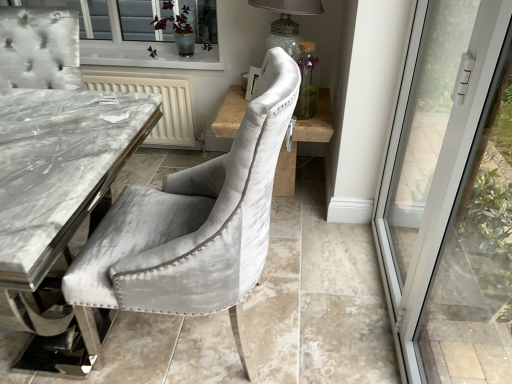
Measure the distance between velvet grey chair at center and camera.

They are 95.61 centimeters apart.

The image size is (512, 384). I want to click on velvet chair at center, so click(x=318, y=296).

Is velvet grey chair at center outside of velvet chair at center?

Yes.

Does velvet grey chair at center have a lesser width compared to velvet chair at center?

Indeed, velvet grey chair at center has a lesser width compared to velvet chair at center.

Between velvet grey chair at center and velvet chair at center, which one has more height?

velvet grey chair at center.

Which point is more forward, (220, 262) or (100, 377)?

The point (220, 262) is in front.

Who is bigger, light brown wood side table at center or transparent glass door at right?

light brown wood side table at center is bigger.

You are a GUI agent. You are given a task and a screenshot of the screen. Output one action in this format:
    pyautogui.click(x=<x>, y=<y>)
    Task: Click on the side table located above the transparent glass door at right (from the image's perspective)
    The width and height of the screenshot is (512, 384).
    Given the screenshot: What is the action you would take?
    pyautogui.click(x=303, y=141)

From a real-world perspective, is light brown wood side table at center over transparent glass door at right?

Incorrect, from a real-world perspective, light brown wood side table at center is lower than transparent glass door at right.

Consider the image. How far apart are light brown wood side table at center and transparent glass door at right?

32.25 inches.

Is transparent glass door at right further to camera compared to light brown wood side table at center?

No, transparent glass door at right is closer to the viewer.

Is transparent glass door at right beside light brown wood side table at center?

No, transparent glass door at right is not touching light brown wood side table at center.

In the scene shown: Could you tell me if transparent glass door at right is turned towards light brown wood side table at center?

No, transparent glass door at right is not aimed at light brown wood side table at center.

From a real-world perspective, is transparent glass door at right physically located above or below light brown wood side table at center?

From a real-world perspective, transparent glass door at right is physically above light brown wood side table at center.

Relative to velvet chair at center, is transparent glass door at right in front or behind?

transparent glass door at right is positioned closer to the viewer than velvet chair at center.

Which is correct: transparent glass door at right is inside velvet chair at center, or outside of it?

transparent glass door at right is not enclosed by velvet chair at center.

Is transparent glass door at right turned away from velvet chair at center?

No, velvet chair at center is not at the back of transparent glass door at right.

From the image's perspective, which one is positioned lower, transparent glass door at right or velvet chair at center?

velvet chair at center appears lower in the image.

From the image's perspective, is purple velvet plant at upper center on top of light brown wood side table at center?

Yes, from the image's perspective, purple velvet plant at upper center is on top of light brown wood side table at center.

Between purple velvet plant at upper center and light brown wood side table at center, which one appears on the right side from the viewer's perspective?

Positioned to the right is light brown wood side table at center.

Image resolution: width=512 pixels, height=384 pixels. In order to click on plant above the light brown wood side table at center (from the image's perspective) in this screenshot , I will do `click(179, 30)`.

Is velvet grey chair at center at the back of velvet chair at center?

velvet chair at center does not have its back to velvet grey chair at center.

Which is closer, (132,324) or (271,67)?

The point (271,67) is in front.

In the scene shown: Considering the relative positions of velvet chair at center and velvet grey chair at center in the image provided, is velvet chair at center to the right of velvet grey chair at center from the viewer's perspective?

In fact, velvet chair at center is to the left of velvet grey chair at center.

Is velvet chair at center surrounding velvet grey chair at center?

Actually, velvet grey chair at center is outside velvet chair at center.

Is light brown wood side table at center positioned far away from velvet chair at center?

That's not correct — light brown wood side table at center is a little close to velvet chair at center.

Identify the location of side table lying on the right of velvet chair at center. The height and width of the screenshot is (384, 512). (303, 141).

Is light brown wood side table at center facing towards velvet chair at center?

No, light brown wood side table at center is not facing towards velvet chair at center.

In order to click on chair above the velvet chair at center (from a real-world perspective) in this screenshot , I will do [195, 223].

Where is `side table on the left of transparent glass door at right`? The height and width of the screenshot is (384, 512). side table on the left of transparent glass door at right is located at coordinates (303, 141).

From the image, which object appears to be nearer to transparent glass door at right, velvet chair at center or purple velvet plant at upper center?

velvet chair at center is closer to transparent glass door at right.

Estimate the real-world distances between objects in this image. Which object is closer to purple velvet plant at upper center, velvet chair at center or velvet grey chair at center?

Among the two, velvet chair at center is located nearer to purple velvet plant at upper center.

When comparing their distances from purple velvet plant at upper center, does velvet grey chair at center or velvet chair at center seem closer?

velvet chair at center is positioned closer to the anchor purple velvet plant at upper center.

From the image, which object appears to be nearer to purple velvet plant at upper center, transparent glass door at right or velvet chair at center?

velvet chair at center lies closer to purple velvet plant at upper center than the other object.

Looking at the image, which one is located further to velvet grey chair at center, transparent glass door at right or light brown wood side table at center?

Among the two, light brown wood side table at center is located further to velvet grey chair at center.

Considering their positions, is velvet chair at center positioned closer to purple velvet plant at upper center than light brown wood side table at center?

The object closer to purple velvet plant at upper center is light brown wood side table at center.

Which object lies nearer to the anchor point light brown wood side table at center, velvet chair at center or purple velvet plant at upper center?

velvet chair at center is positioned closer to the anchor light brown wood side table at center.

Based on their spatial positions, is velvet chair at center or light brown wood side table at center further from transparent glass door at right?

Based on the image, light brown wood side table at center appears to be further to transparent glass door at right.

This screenshot has width=512, height=384. Find the location of `side table located between velvet grey chair at center and purple velvet plant at upper center in the depth direction`. side table located between velvet grey chair at center and purple velvet plant at upper center in the depth direction is located at coordinates (303, 141).

Locate an element on the screen. Image resolution: width=512 pixels, height=384 pixels. side table positioned between transparent glass door at right and purple velvet plant at upper center from near to far is located at coordinates (303, 141).

Where is `concrete between velvet grey chair at center and purple velvet plant at upper center from front to back`? concrete between velvet grey chair at center and purple velvet plant at upper center from front to back is located at coordinates (318, 296).

Find the location of `concrete positioned between transparent glass door at right and purple velvet plant at upper center from near to far`. concrete positioned between transparent glass door at right and purple velvet plant at upper center from near to far is located at coordinates (318, 296).